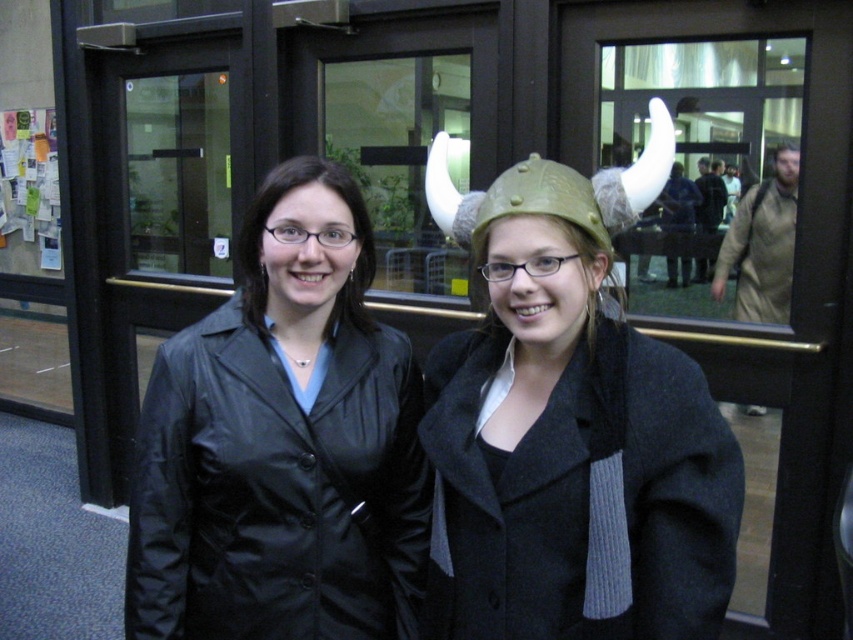
Does point (485, 195) come closer to viewer compared to point (527, 176)?

No, (485, 195) is behind (527, 176).

In the scene shown: Can you confirm if gold metallic helmet at center is smaller than matte olive green helmet at center?

Actually, gold metallic helmet at center might be larger than matte olive green helmet at center.

Between point (442, 168) and point (561, 180), which one is positioned in front?

Point (561, 180) is in front.

The image size is (853, 640). What are the coordinates of `gold metallic helmet at center` in the screenshot? It's located at (633, 179).

What do you see at coordinates (572, 432) in the screenshot?
I see `matte gold helmet at center` at bounding box center [572, 432].

Is point (614, 634) farther from camera compared to point (611, 225)?

No.

Is point (541, 451) behind point (561, 186)?

Yes.

I want to click on matte gold helmet at center, so click(572, 432).

Is matte gold helmet at center positioned at the back of matte olive green helmet at center?

Yes, it is.

Consider the image. Is matte gold helmet at center below matte olive green helmet at center?

Indeed, matte gold helmet at center is positioned under matte olive green helmet at center.

Is point (514, 484) in front of point (503, 192)?

No.

Where is `matte gold helmet at center`? matte gold helmet at center is located at coordinates (572, 432).